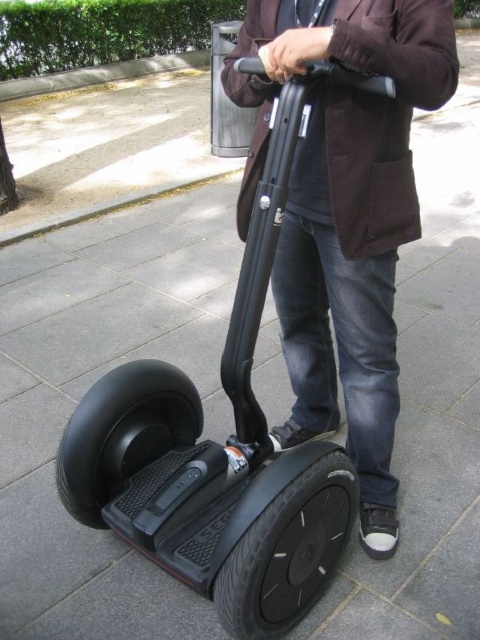
You are a pedestrian walking on the sidewalk and see the dark brown leather jacket at center and the black rubber scooter at center. Which object is nearer to you?

The dark brown leather jacket at center is closer to the viewer than the black rubber scooter at center, so the dark brown leather jacket at center is nearer to you.